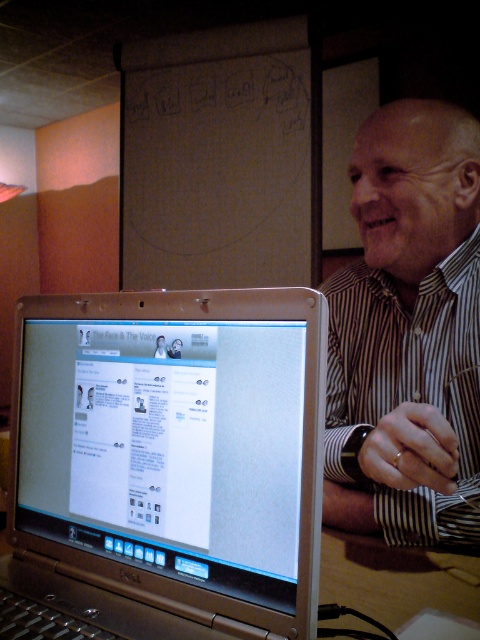
Does silver metallic laptop at center appear under striped shirt at right?

Yes, silver metallic laptop at center is below striped shirt at right.

Which is behind, point (97, 548) or point (408, 492)?

Point (408, 492)

Locate an element on the screen. silver metallic laptop at center is located at coordinates (170, 460).